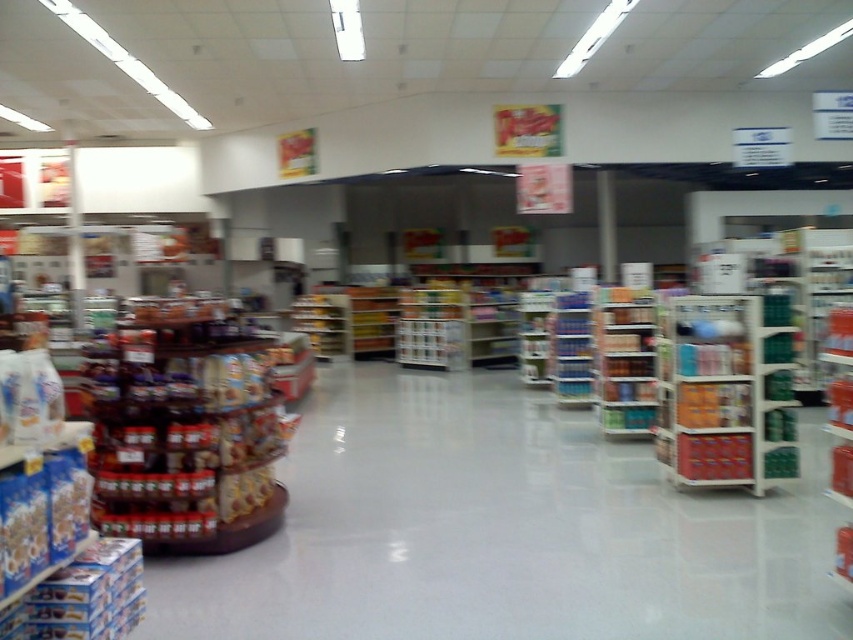
Can you confirm if shiny plastic snacks at left is taller than green plastic shelf at center?

No, shiny plastic snacks at left is not taller than green plastic shelf at center.

Between shiny plastic snacks at left and green plastic shelf at center, which one is positioned higher?

green plastic shelf at center

Does point (107, 342) come in front of point (653, 422)?

Yes, point (107, 342) is in front of point (653, 422).

Identify the location of shiny plastic snacks at left. The image size is (853, 640). (184, 435).

Is shiny plastic snacks at left above metallic silver shelves at center-right?

No, shiny plastic snacks at left is not above metallic silver shelves at center-right.

Does shiny plastic snacks at left appear on the right side of metallic silver shelves at center-right?

In fact, shiny plastic snacks at left is to the left of metallic silver shelves at center-right.

Which is behind, point (254, 456) or point (677, 364)?

The point (677, 364) is more distant.

In order to click on shiny plastic snacks at left in this screenshot , I will do `click(184, 435)`.

Locate an element on the screen. The width and height of the screenshot is (853, 640). shiny plastic snacks at left is located at coordinates (184, 435).

Can you confirm if shiny plastic snacks at left is positioned to the left of blue plastic bottles at center?

Yes, shiny plastic snacks at left is to the left of blue plastic bottles at center.

Between point (149, 328) and point (573, 403), which one is positioned in front?

Point (149, 328)

You are a GUI agent. You are given a task and a screenshot of the screen. Output one action in this format:
    pyautogui.click(x=<x>, y=<y>)
    Task: Click on the shiny plastic snacks at left
    The width and height of the screenshot is (853, 640).
    Given the screenshot: What is the action you would take?
    pyautogui.click(x=184, y=435)